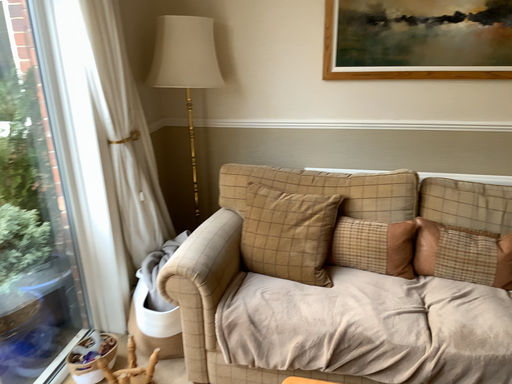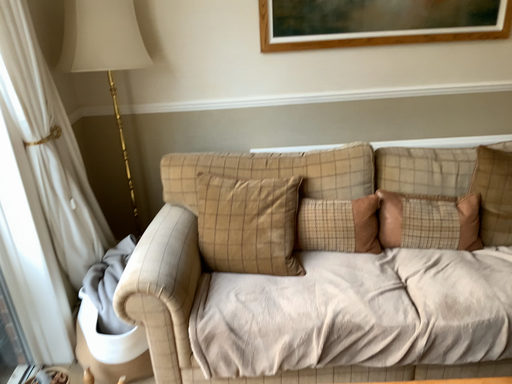
Question: Which way did the camera rotate in the video?

Choices:
 (A) rotated left
 (B) rotated right

Answer: (B)